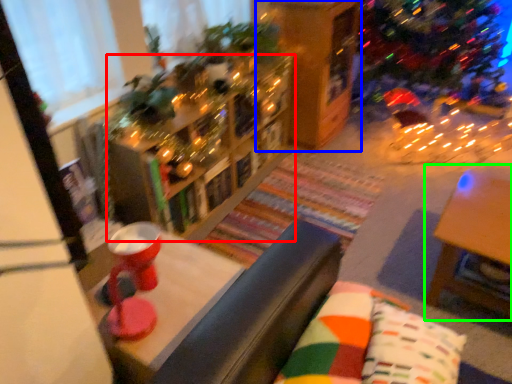
Question: Estimate the real-world distances between objects in this image. Which object is farther from bookcase (highlighted by a red box), shelf (highlighted by a blue box) or table (highlighted by a green box)?

Choices:
 (A) shelf
 (B) table

Answer: (B)